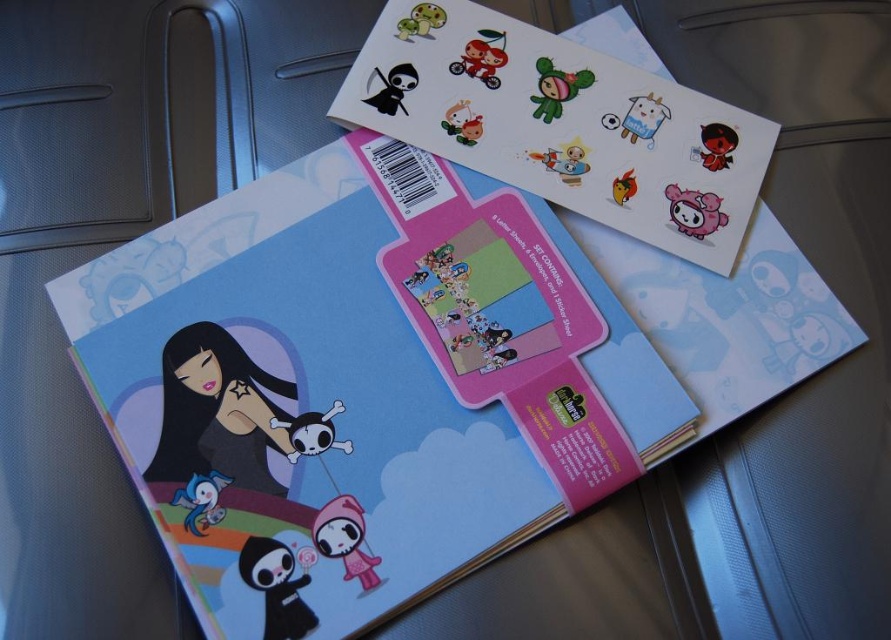
Question: Among these points, which one is nearest to the camera?

Choices:
 (A) (480, 109)
 (B) (668, 413)

Answer: (B)

Question: Which of the following is the closest to the observer?

Choices:
 (A) (687, 163)
 (B) (238, 612)

Answer: (B)

Question: Does matte paper envelope at center come in front of transparent plastic stickers at upper center?

Choices:
 (A) no
 (B) yes

Answer: (B)

Question: Which of the following is the farthest from the observer?

Choices:
 (A) matte paper envelope at center
 (B) transparent plastic stickers at upper center

Answer: (B)

Question: Can you confirm if matte paper envelope at center is thinner than transparent plastic stickers at upper center?

Choices:
 (A) no
 (B) yes

Answer: (A)

Question: Can you confirm if matte paper envelope at center is positioned to the left of transparent plastic stickers at upper center?

Choices:
 (A) no
 (B) yes

Answer: (B)